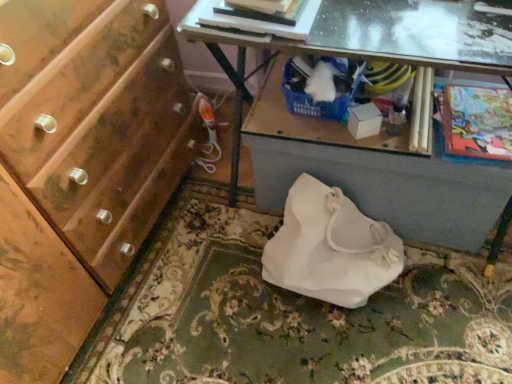
Locate an element on the screen. vacant space that is to the left of white cardboard box at center is located at coordinates (312, 126).